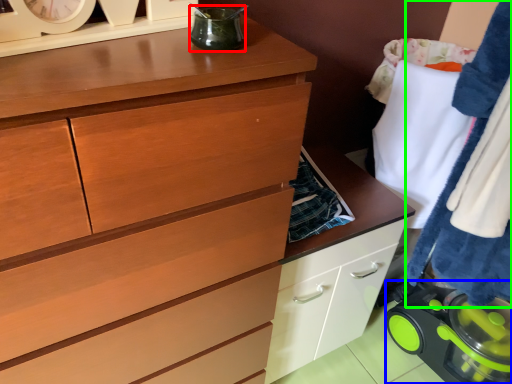
Question: Considering the real-world distances, which object is farthest from appliance (highlighted by a red box)? appliance (highlighted by a blue box) or clothing (highlighted by a green box)?

Choices:
 (A) appliance
 (B) clothing

Answer: (A)